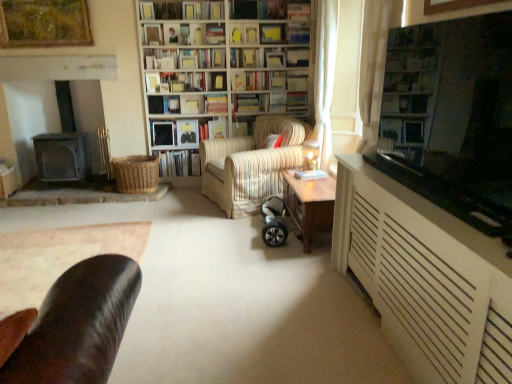
Question: Does striped fabric armchair at center lie behind dark wood fireplace at left?

Choices:
 (A) no
 (B) yes

Answer: (A)

Question: From a real-world perspective, is striped fabric armchair at center over dark wood fireplace at left?

Choices:
 (A) yes
 (B) no

Answer: (B)

Question: Can you confirm if striped fabric armchair at center is smaller than dark wood fireplace at left?

Choices:
 (A) yes
 (B) no

Answer: (B)

Question: From the image's perspective, is striped fabric armchair at center under dark wood fireplace at left?

Choices:
 (A) yes
 (B) no

Answer: (A)

Question: Is striped fabric armchair at center positioned beyond the bounds of dark wood fireplace at left?

Choices:
 (A) no
 (B) yes

Answer: (B)

Question: From the image's perspective, is striped fabric armchair at center above dark wood fireplace at left?

Choices:
 (A) no
 (B) yes

Answer: (A)

Question: Does hardcover book at center, which is the 6th book in top-to-bottom order, have a greater width compared to white textured cabinet at right?

Choices:
 (A) no
 (B) yes

Answer: (A)

Question: Is hardcover book at center, marked as the 7th book in a bottom-to-top arrangement, located outside white textured cabinet at right?

Choices:
 (A) yes
 (B) no

Answer: (A)

Question: Does hardcover book at center, which is the 6th book in top-to-bottom order, have a greater height compared to white textured cabinet at right?

Choices:
 (A) yes
 (B) no

Answer: (B)

Question: Is the position of hardcover book at center, which is the 6th book in top-to-bottom order, less distant than that of white textured cabinet at right?

Choices:
 (A) yes
 (B) no

Answer: (B)

Question: Does hardcover book at center, marked as the 7th book in a bottom-to-top arrangement, have a smaller size compared to white textured cabinet at right?

Choices:
 (A) yes
 (B) no

Answer: (A)

Question: Is white textured cabinet at right completely or partially inside hardcover book at center, which is the 6th book in top-to-bottom order?

Choices:
 (A) yes
 (B) no

Answer: (B)

Question: Is hardcover book at center, which appears as the fourth book when ordered from the bottom, aimed at striped fabric armchair at center?

Choices:
 (A) no
 (B) yes

Answer: (B)